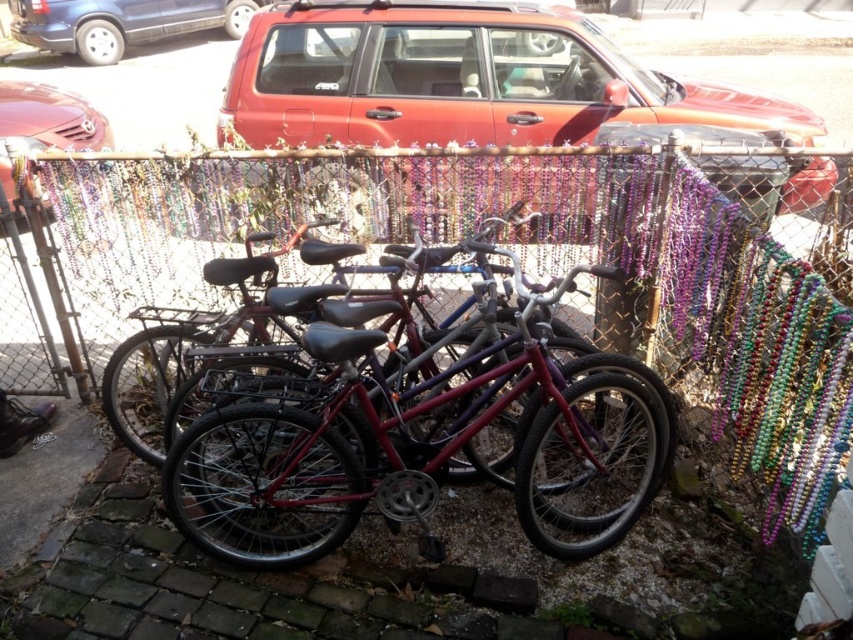
Which is above, metallic chain-link fence at center or shiny red bicycle at center?

Positioned higher is metallic chain-link fence at center.

Which is behind, point (831, 250) or point (614, 273)?

Point (831, 250)

Between point (555, 275) and point (381, 433), which one is positioned behind?

The point (555, 275) is more distant.

Where is `metallic chain-link fence at center`? The image size is (853, 640). metallic chain-link fence at center is located at coordinates (457, 241).

Does metallic chain-link fence at center have a greater height compared to matte red suv at center?

No, metallic chain-link fence at center is not taller than matte red suv at center.

Find the location of a particular element. metallic chain-link fence at center is located at coordinates (457, 241).

You are a GUI agent. You are given a task and a screenshot of the screen. Output one action in this format:
    pyautogui.click(x=<x>, y=<y>)
    Task: Click on the metallic chain-link fence at center
    Image resolution: width=853 pixels, height=640 pixels.
    Given the screenshot: What is the action you would take?
    click(457, 241)

Can you confirm if shiny red bicycle at center is positioned to the right of blue metallic van at upper left?

Indeed, shiny red bicycle at center is positioned on the right side of blue metallic van at upper left.

Can you confirm if shiny red bicycle at center is taller than blue metallic van at upper left?

No.

Between point (489, 394) and point (51, 4), which one is positioned behind?

Point (51, 4)

What are the coordinates of `shiny red bicycle at center` in the screenshot? It's located at (418, 449).